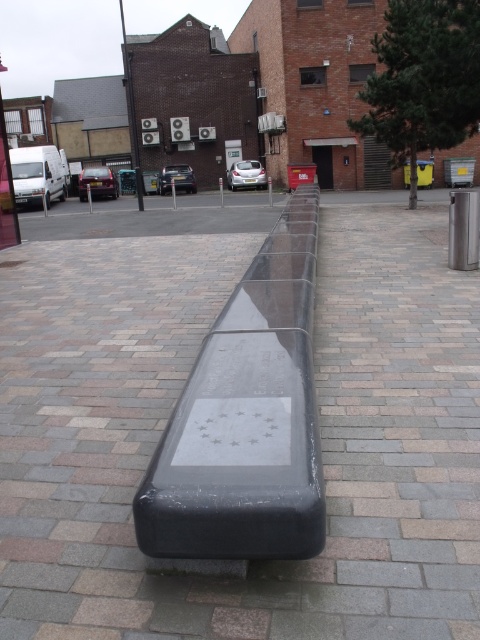
Who is more forward, (348,509) or (248,280)?

Positioned in front is point (348,509).

Between point (14, 355) and point (294, 280), which one is positioned behind?

Positioned behind is point (294, 280).

The height and width of the screenshot is (640, 480). What are the coordinates of `black polished bench at center` in the screenshot? It's located at (171, 406).